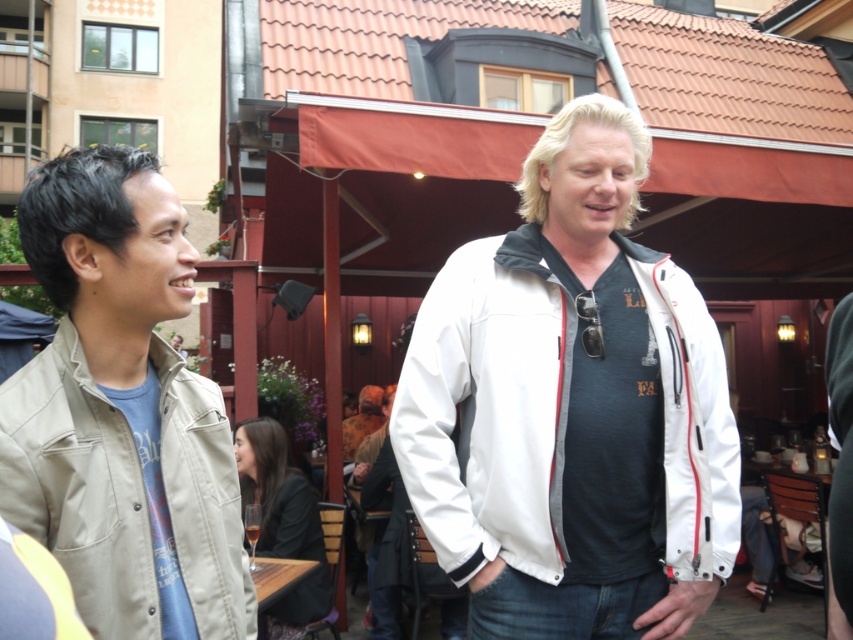
From the picture: You are standing in the outdoor scene and want to locate the khaki cotton jacket at left. Which direction should you look relative to the white smooth jacket at center?

The khaki cotton jacket at left is to the left of the white smooth jacket at center.

You are a photographer trying to capture a clear shot of both the khaki cotton jacket at left and the dark brown leather jacket at lower center. Since you want both jackets to be visible in the photo, which jacket should you focus on first to ensure the other remains in the frame?

You should focus on the khaki cotton jacket at left first because it is in front of the dark brown leather jacket at lower center, ensuring the background jacket stays visible while the foreground jacket is in clear focus.